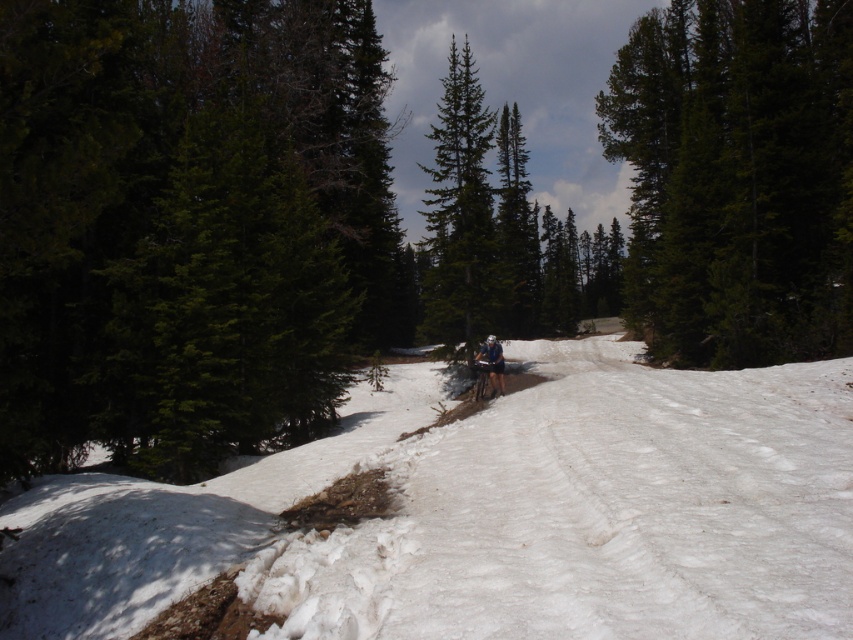
Question: Which of the following is the farthest from the observer?

Choices:
 (A) (466, 180)
 (B) (722, 436)

Answer: (A)

Question: Does green textured pine tree at center have a larger size compared to white helmet at center?

Choices:
 (A) yes
 (B) no

Answer: (A)

Question: Is white powdery snow at center positioned in front of green textured pine tree at center?

Choices:
 (A) yes
 (B) no

Answer: (A)

Question: Which object appears closest to the camera in this image?

Choices:
 (A) green textured pine tree at center
 (B) white powdery snow at center
 (C) green matte tree at upper right

Answer: (B)

Question: Which point is farther to the camera?

Choices:
 (A) (492, 369)
 (B) (422, 211)

Answer: (B)

Question: Does white powdery snow at center have a greater width compared to green textured pine tree at center?

Choices:
 (A) yes
 (B) no

Answer: (B)